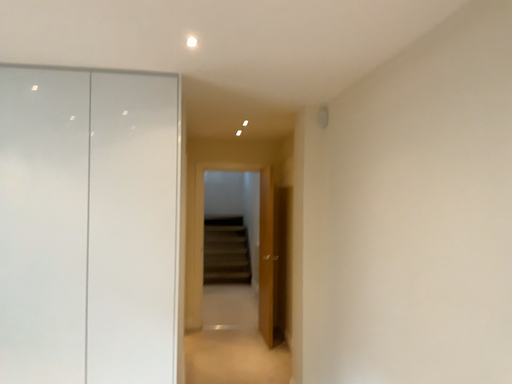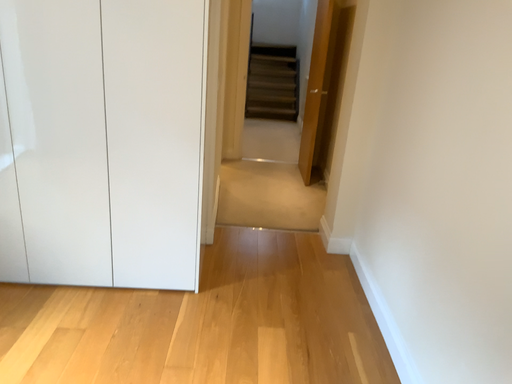
Question: Which way did the camera rotate in the video?

Choices:
 (A) rotated downward
 (B) rotated upward

Answer: (A)